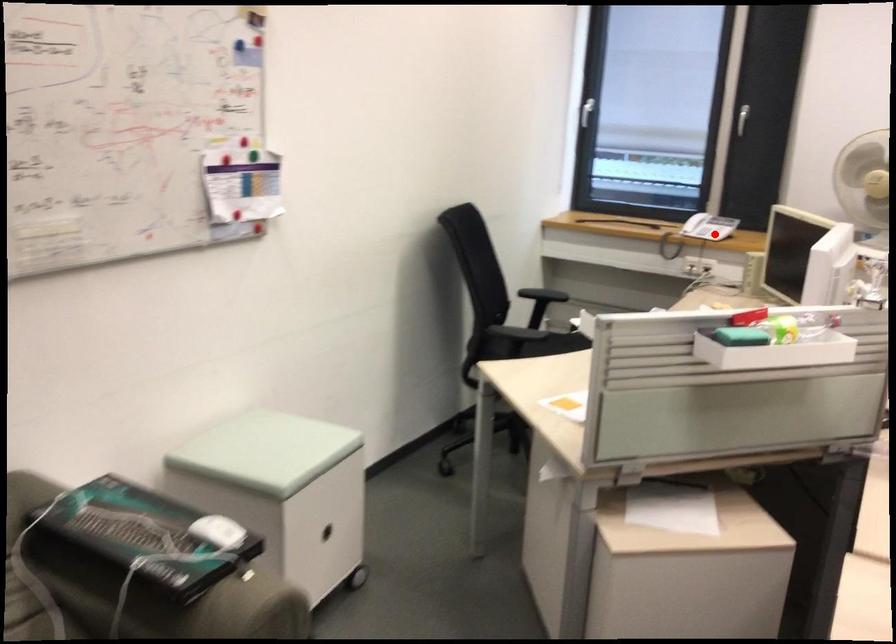
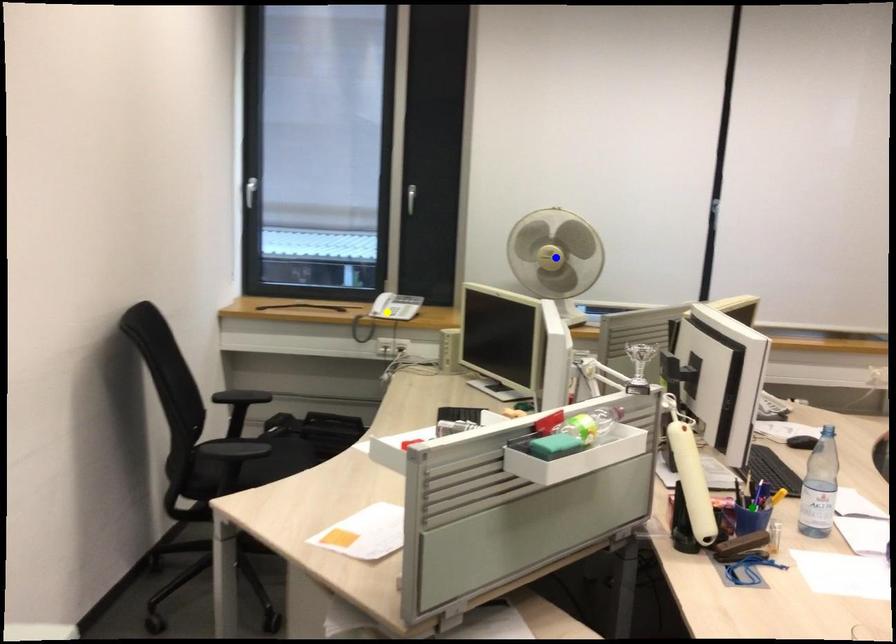
Question: I am providing you with two images of the same scene from different viewpoints. A red point is marked on the first image. You are given multiple points on the second image. Which mark in image 2 goes with the point in image 1?

Choices:
 (A) blue point
 (B) yellow point
 (C) green point

Answer: (B)